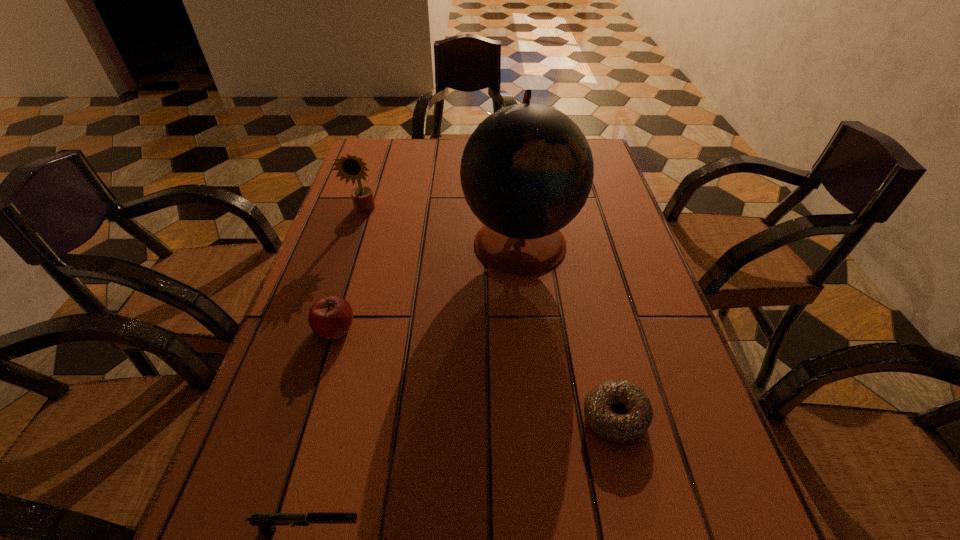
Image resolution: width=960 pixels, height=540 pixels. Find the location of `the tallest object`. the tallest object is located at coordinates (526, 172).

Locate an element on the screen. The image size is (960, 540). sunflower is located at coordinates (348, 167).

The width and height of the screenshot is (960, 540). Find the location of `the third tallest object`. the third tallest object is located at coordinates (331, 317).

You are a GUI agent. You are given a task and a screenshot of the screen. Output one action in this format:
    pyautogui.click(x=<x>, y=<y>)
    Task: Click on the apple
    This screenshot has height=540, width=960.
    Given the screenshot: What is the action you would take?
    pyautogui.click(x=331, y=317)

The width and height of the screenshot is (960, 540). Identify the location of gun. (266, 522).

You are a GUI agent. You are given a task and a screenshot of the screen. Output one action in this format:
    pyautogui.click(x=<x>, y=<y>)
    Task: Click on the nearest object
    The image size is (960, 540).
    Given the screenshot: What is the action you would take?
    pyautogui.click(x=266, y=522)

The image size is (960, 540). Identify the location of the fourth farthest object. (618, 411).

This screenshot has height=540, width=960. What are the coordinates of `doughnut` in the screenshot? It's located at (618, 411).

At what (x,y) coordinates should I click in order to perform the action: click on vacant area situated with the Americas facing the viewer on the globe. Please return your answer as a coordinate pair (x, y). The image size is (960, 540). Looking at the image, I should click on (415, 241).

Where is `free region located with the Americas facing the viewer on the globe`? This screenshot has height=540, width=960. free region located with the Americas facing the viewer on the globe is located at coordinates (326, 241).